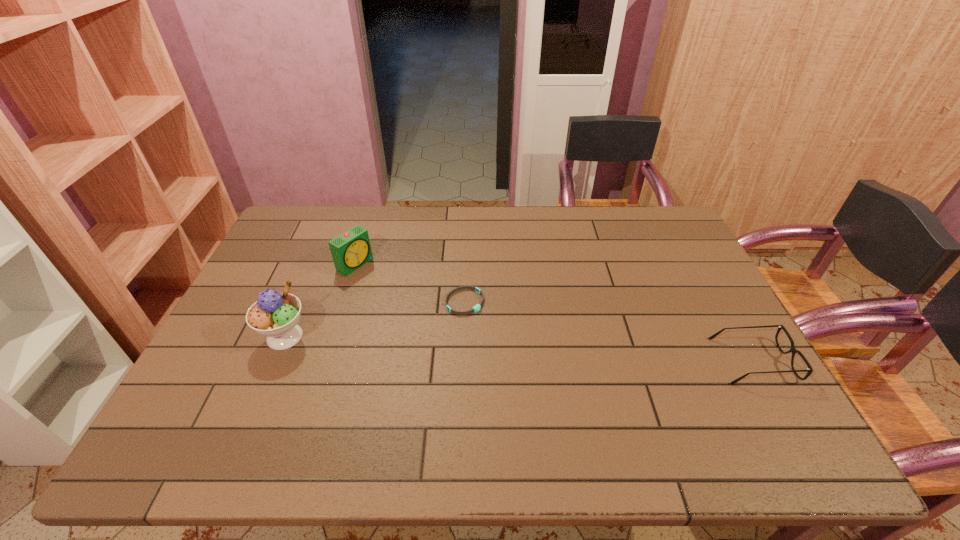
Identify the location of icecream. (275, 315).

At what (x,y) coordinates should I click in order to perform the action: click on the leftmost object. Please return your answer as a coordinate pair (x, y). Looking at the image, I should click on (275, 315).

Identify the location of the rightmost object. (793, 350).

In order to click on spectacles in this screenshot , I will do `click(793, 350)`.

Identify the location of the second tallest object. The width and height of the screenshot is (960, 540). (350, 250).

Where is `the farthest object`? Image resolution: width=960 pixels, height=540 pixels. the farthest object is located at coordinates (350, 250).

Locate an element on the screen. The width and height of the screenshot is (960, 540). the shortest object is located at coordinates (476, 308).

Find the location of a particular element. This screenshot has height=540, width=960. the third object from left to right is located at coordinates (476, 308).

I want to click on free point located 0.090m on the right of the tallest object, so click(x=344, y=336).

I want to click on vacant space positioned with the lenses facing outward on the third tallest object, so click(561, 361).